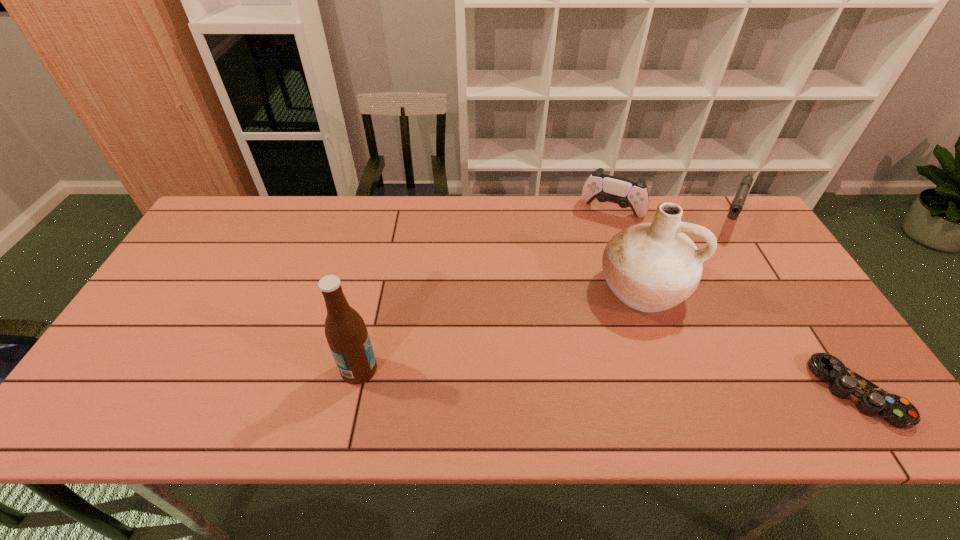
Find the location of a particular element. The width and height of the screenshot is (960, 540). vacant space that satisfies the following two spatial constraints: 1. on the front side of the shorter control; 2. on the left side of the taller control is located at coordinates (673, 392).

Locate an element on the screen. Image resolution: width=960 pixels, height=540 pixels. free location that satisfies the following two spatial constraints: 1. on the front side of the shorter control; 2. on the left side of the pottery is located at coordinates [x=677, y=392].